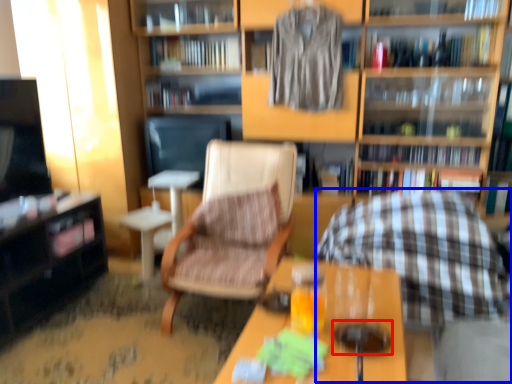
Question: Which object appears closest to the camera in this image, beverage (highlighted by a red box) or rocking chair (highlighted by a blue box)?

Choices:
 (A) beverage
 (B) rocking chair

Answer: (A)